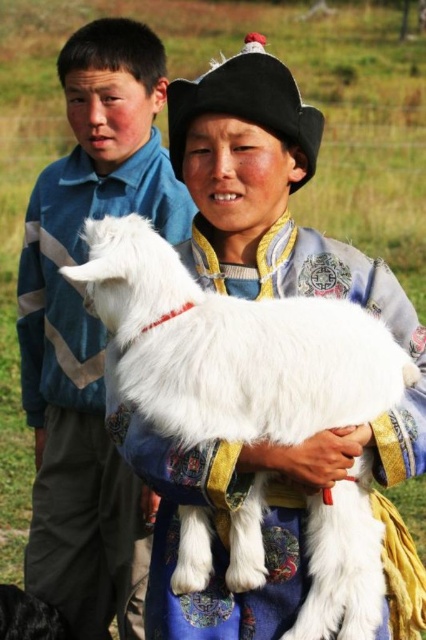
You are a photographer trying to capture a group photo of the two people and the lamb. The camera frame can only accommodate objects with a width of up to 1.2 meters. Given that the fluffy white lamb at center is wider than the matte blue shirt at center, will both the lamb and the shirt fit within the frame?

The fluffy white lamb at center is wider than the matte blue shirt at center. Since the camera frame can only accommodate up to 1.2 meters, if the lamb is wider than 1.2 meters, it won not fit. However, if the lamb is under 1.2 meters in width, both the lamb and the shirt will fit as the shirt is narrower. The exact dimensions are not provided, so it depends on the lamb width.

You are a photographer trying to capture a group photo of the two people and the animals in the scene. You want to ensure that the fluffy white lamb at center and the matte blue shirt at center are both visible in the frame. Based on their positions, which one should you place closer to the center of the photo to ensure both are visible?

The fluffy white lamb at center is already positioned on the right side of the matte blue shirt at center. To ensure both are visible in the frame, you should place the matte blue shirt at center closer to the center of the photo since it is currently to the left of the lamb.

You are a photographer standing in a rural setting. You want to take a closeup photo of the fluffy white lamb at center. The camera you are using has a minimum focusing distance of 3 meters. Can you take the photo without moving closer?

The fluffy white lamb at center is 2.95 meters away from the viewer. Since the minimum focusing distance is 3 meters, the camera cannot focus at that distance. You need to move back slightly to increase the distance to at least 3 meters or use a different camera with a shorter minimum focusing distance.